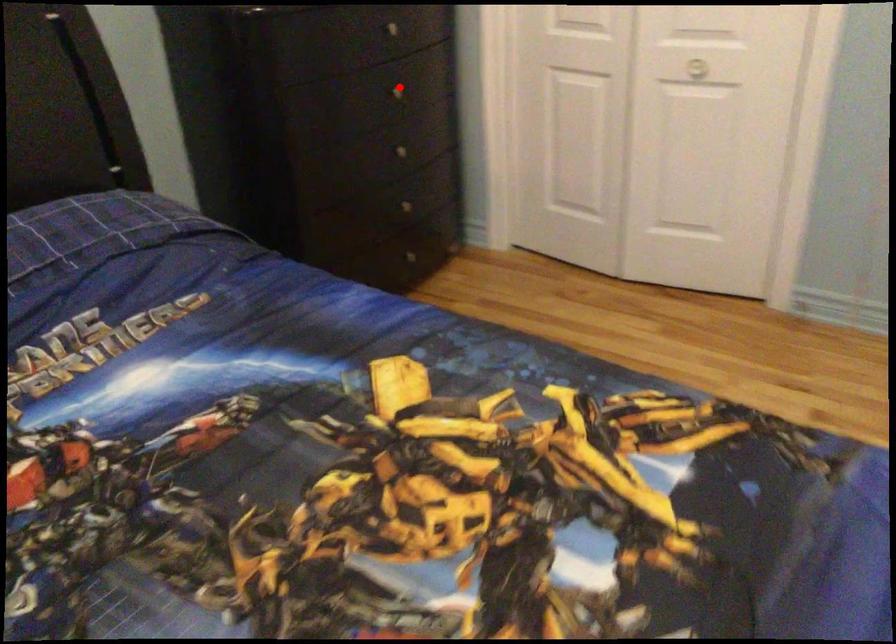
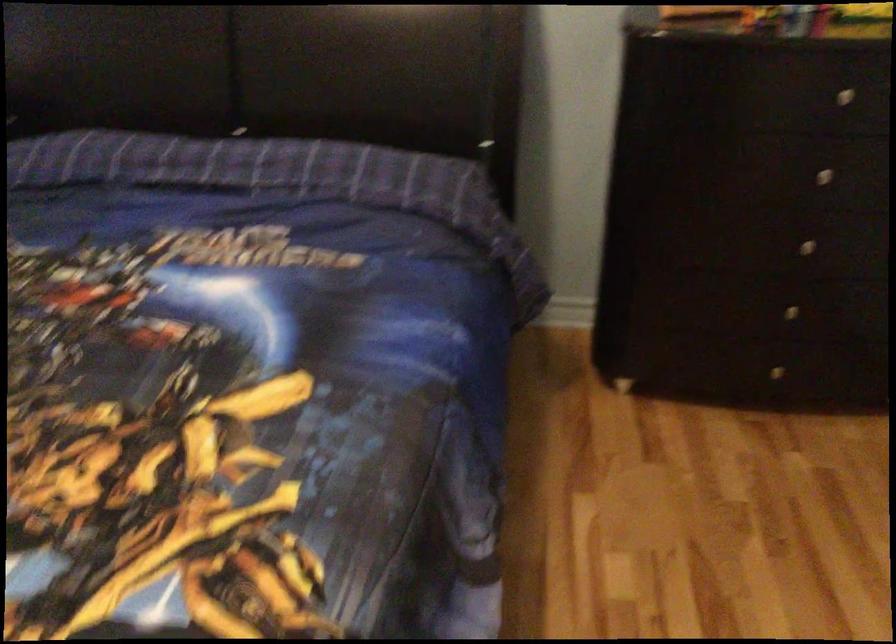
Question: A red point is marked in image1. In image2, is the corresponding 3D point closer to the camera or farther? Reply with the corresponding letter.

Choices:
 (A) The corresponding 3D point is closer.
 (B) The corresponding 3D point is farther.

Answer: (A)